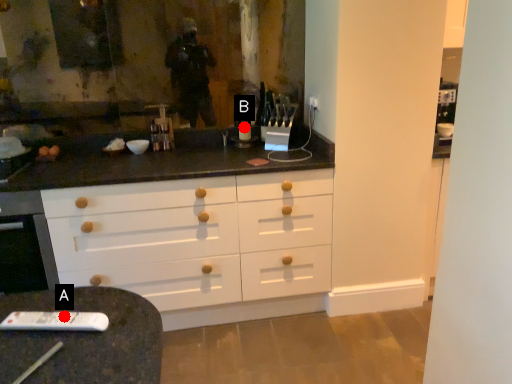
Question: Two points are circled on the image, labeled by A and B beside each circle. Which point is further to the camera?

Choices:
 (A) A is further
 (B) B is further

Answer: (B)